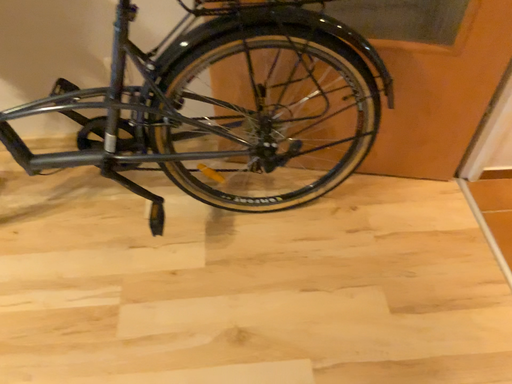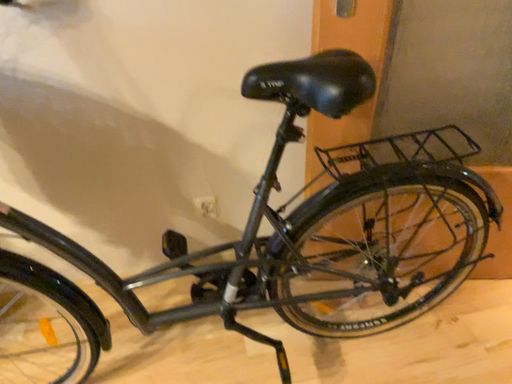
Question: Which way did the camera rotate in the video?

Choices:
 (A) rotated upward
 (B) rotated downward

Answer: (A)